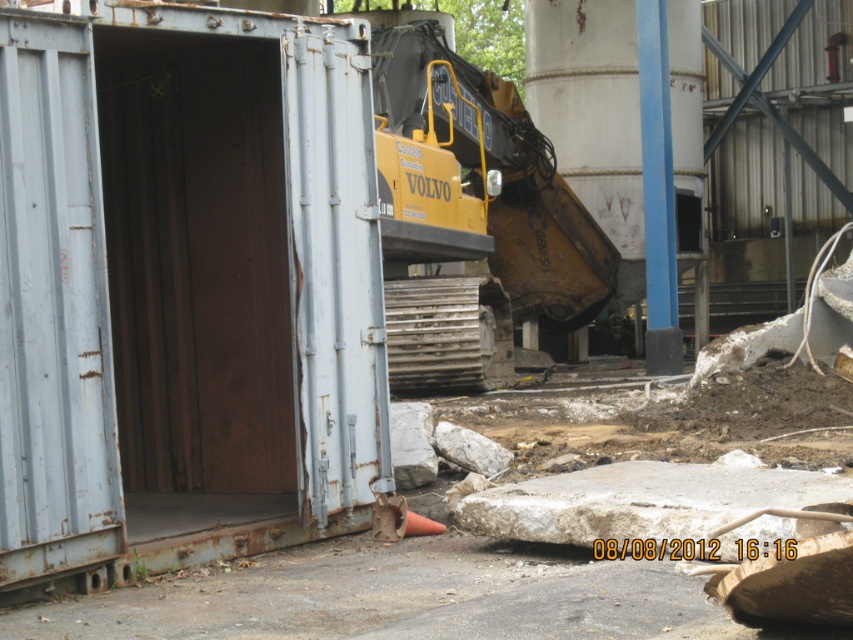
Can you confirm if rusty metal shipping container at left is positioned to the right of yellow metallic excavator at center?

In fact, rusty metal shipping container at left is to the left of yellow metallic excavator at center.

Is point (125, 580) closer to viewer compared to point (401, 156)?

That is True.

You are a GUI agent. You are given a task and a screenshot of the screen. Output one action in this format:
    pyautogui.click(x=<x>, y=<y>)
    Task: Click on the rusty metal shipping container at left
    
    Given the screenshot: What is the action you would take?
    pyautogui.click(x=184, y=288)